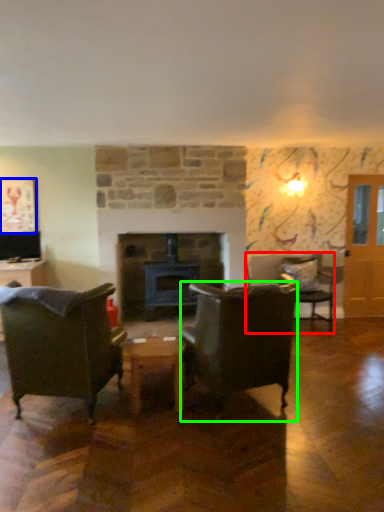
Question: Which is farther away from chair (highlighted by a red box)? picture frame (highlighted by a blue box) or chair (highlighted by a green box)?

Choices:
 (A) picture frame
 (B) chair

Answer: (A)